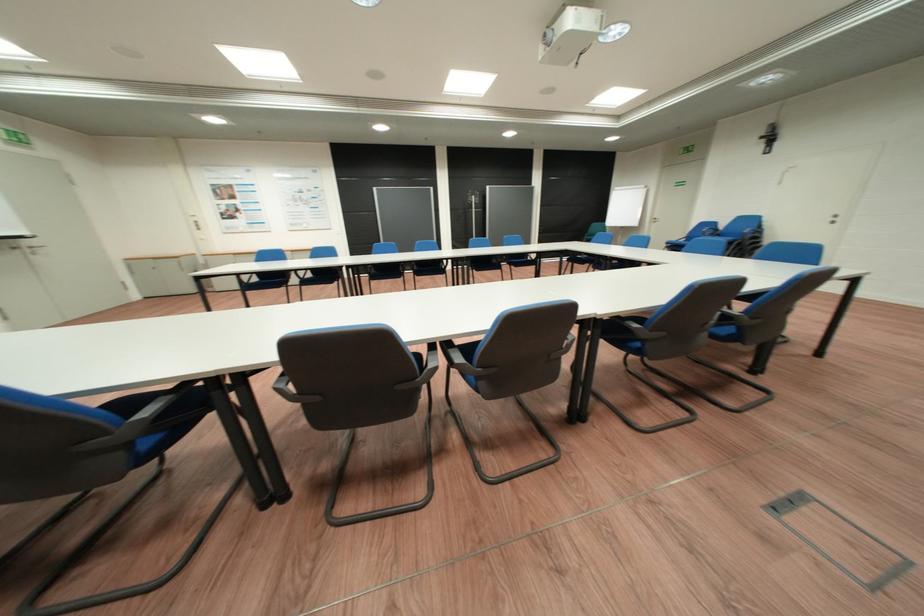
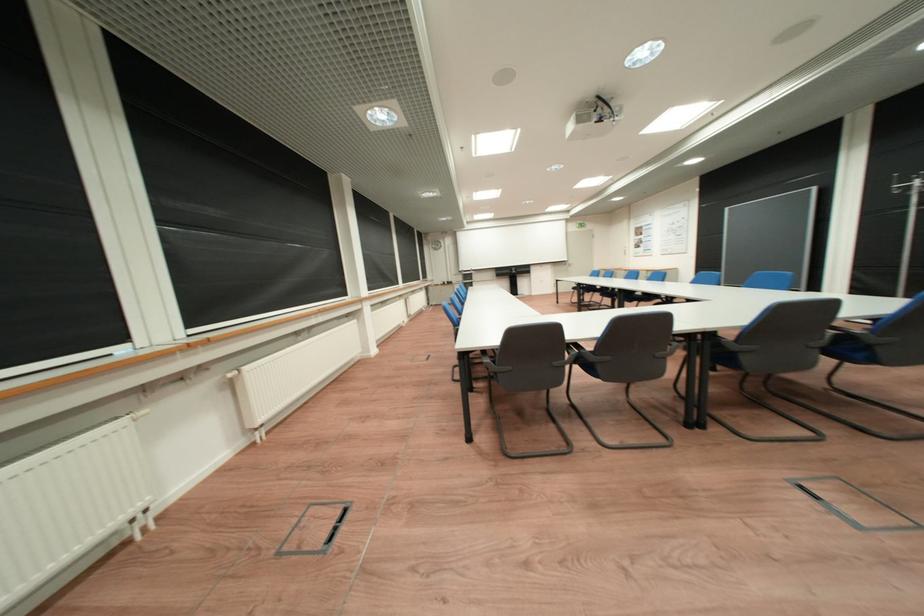
Question: I am providing you with two images of the same scene from different viewpoints. Which of the following objects are not visible in image2?

Choices:
 (A) black chair armrest
 (B) white radiator valve
 (C) grey chair armrest
 (D) white recessed handle

Answer: (A)